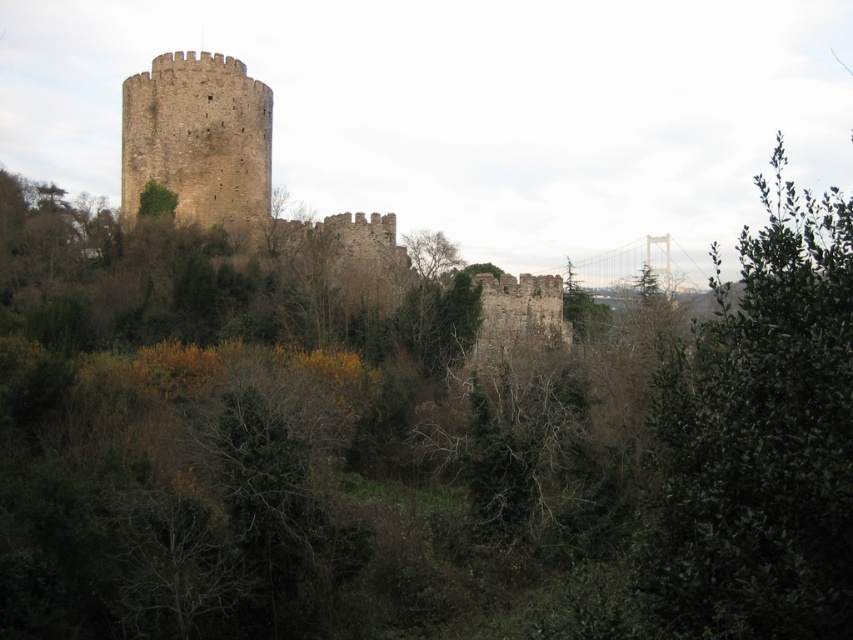
You are standing at the base of the historic stone tower and notice two points marked in the scene. The first point is at coordinate point (828, 328) and the second is at coordinate point (216, 80). Which of these two points is closer to your current position?

Point (216, 80) is closer to your current position because it is behind point (828, 328), which is in front of it.

You are standing in the historic stone structure and want to take a photo of the brown stone tower at center. However, there is a green leafy tree at right in your view. Can you adjust your position to avoid the tree blocking the tower?

The green leafy tree at right is in front of the brown stone tower at center, so you can move to the left side to position yourself where the tree no longer blocks the view of the tower.